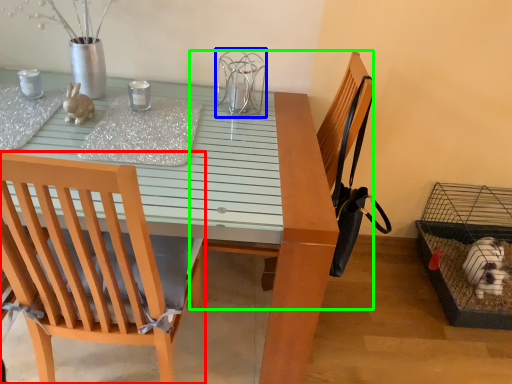
Question: Considering the real-world distances, which object is farthest from chair (highlighted by a red box)? bird cage (highlighted by a blue box) or armchair (highlighted by a green box)?

Choices:
 (A) bird cage
 (B) armchair

Answer: (B)